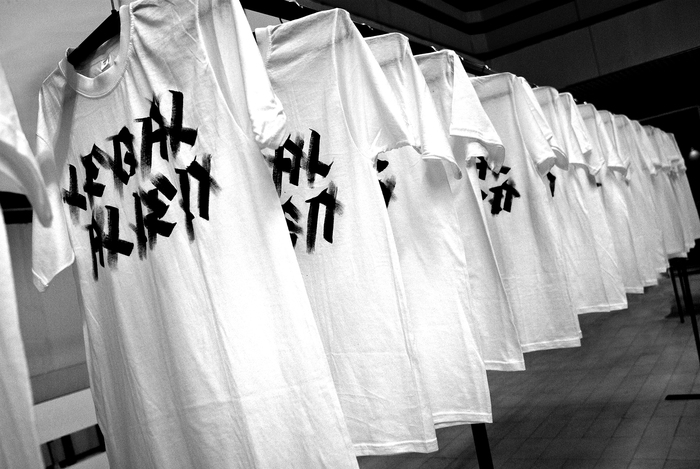
Locate an element on the screen. This screenshot has width=700, height=469. floor is located at coordinates (614, 420).